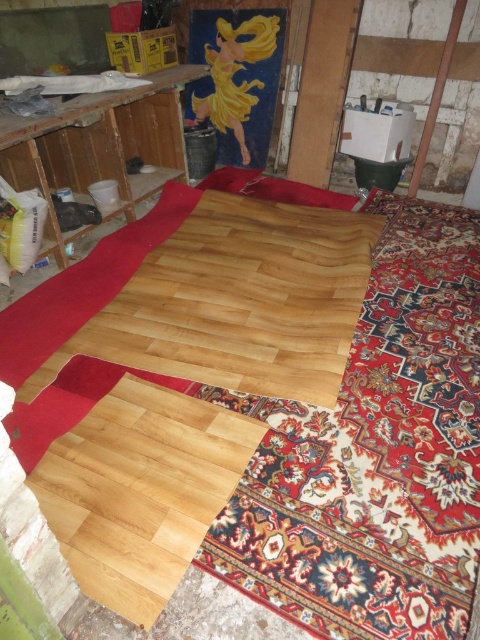
Which of these two, natural wood floor at center or natural wood plank at center, stands taller?

natural wood floor at center is taller.

Who is positioned more to the right, natural wood floor at center or natural wood plank at center?

natural wood floor at center is more to the right.

Who is more forward, (367, 381) or (300, 250)?

Positioned in front is point (367, 381).

Where is `natural wood floor at center`? The image size is (480, 640). natural wood floor at center is located at coordinates (373, 454).

Is natural wood plank at center bigger than natural wood flooring at center?

Indeed, natural wood plank at center has a larger size compared to natural wood flooring at center.

At what (x,y) coordinates should I click in order to perform the action: click on natural wood plank at center. Please return your answer as a coordinate pair (x, y). Looking at the image, I should click on (239, 301).

Identify the location of natural wood floor at center. (373, 454).